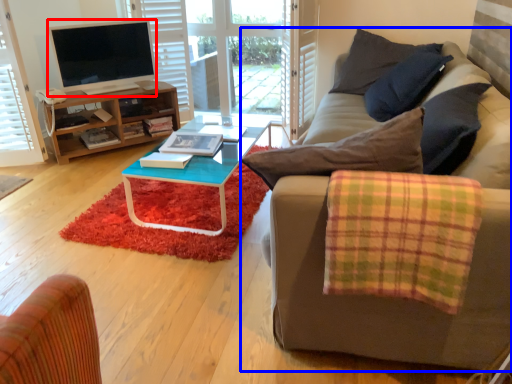
Question: Which point is closer to the camera, television (highlighted by a red box) or studio couch (highlighted by a blue box)?

Choices:
 (A) television
 (B) studio couch

Answer: (B)